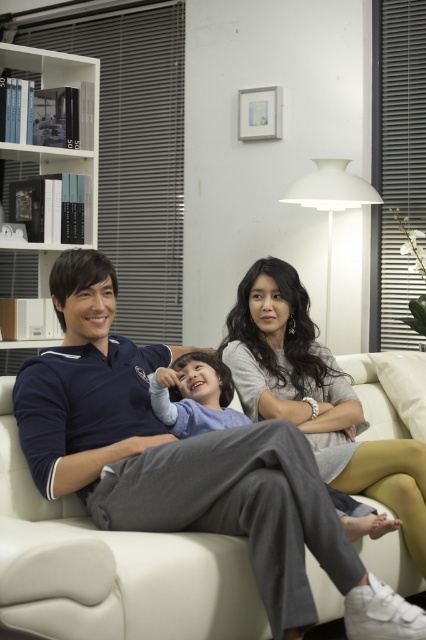
From the picture: You are a delivery robot with a package that is 1.9 meters long. You need to navigate through the living room to deliver it to the sofa where the people are sitting. Is there enough space between the white glossy bookshelf at left and the light blue fabric shirt at center to move the package through?

The distance between the white glossy bookshelf at left and the light blue fabric shirt at center is 1.85 meters, which is shorter than the 1.9 meter package. Therefore, the package cannot fit through that space.

You are a delivery robot that is 24 inches wide. You need to move through the living room to deliver a package to the kitchen. There is a white leather couch at center and a light blue fabric shirt at center in your path. Can you fit through the space between them?

The distance between the white leather couch at center and the light blue fabric shirt at center is 27.00 inches. Since the robot is 24 inches wide, it can fit through the space between them as 27 inches is wider than 24 inches.